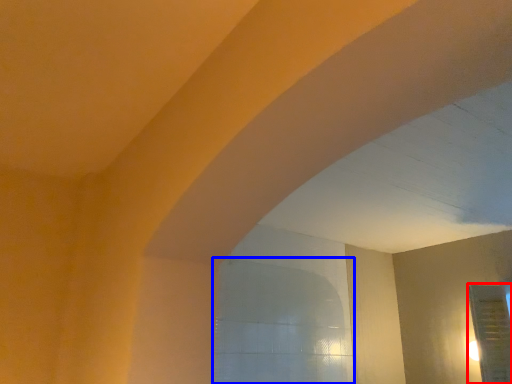
Question: Which point is further to the camera, glass door (highlighted by a red box) or window (highlighted by a blue box)?

Choices:
 (A) glass door
 (B) window

Answer: (A)